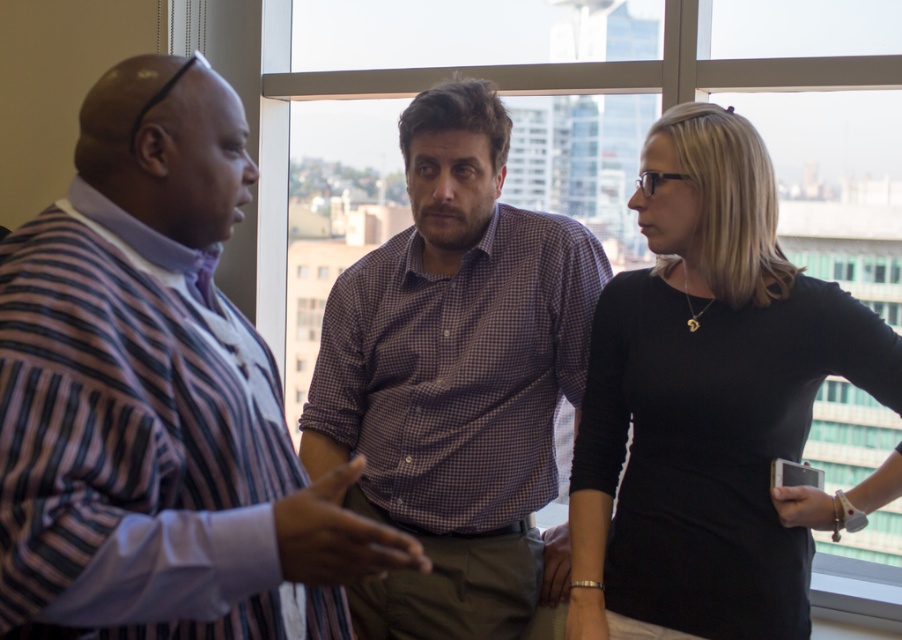
You are an observer in the room. You see two shirts at the center of the image, a striped fabric shirt at center and a purple checkered shirt at center. Which shirt is positioned to the left?

The striped fabric shirt at center is to the left of the purple checkered shirt at center.

You are an observer in the room. You see the striped fabric shirt at center and the purple checkered shirt at center. Which one is positioned higher relative to the other?

The striped fabric shirt at center is located above the purple checkered shirt at center, so it is positioned higher.

You are an interior designer assessing the office layout. The striped fabric shirt at center and the transparent glass window at center are both in your field of view. Which object occupies more horizontal space in the scene?

The transparent glass window at center occupies more horizontal space than the striped fabric shirt at center because the striped fabric shirt at center has a lesser width compared to the transparent glass window at center.